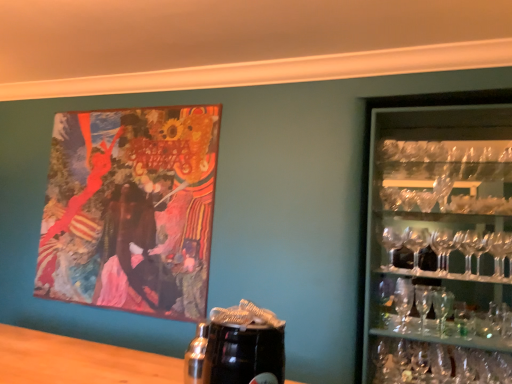
Identify the location of free space above transparent glassware at right (from a real-world perspective). Image resolution: width=512 pixels, height=384 pixels. (456, 109).